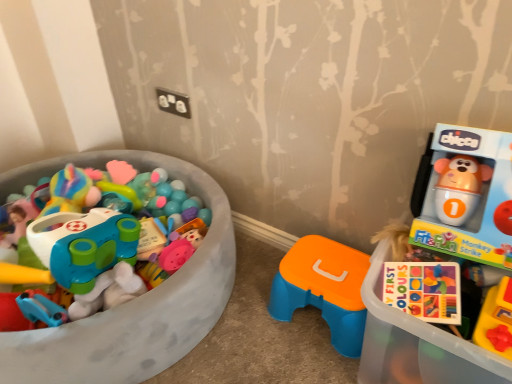
Question: From the image's perspective, is matte plastic toy car at left, the 2th toy in the right-to-left sequence, on orange plastic stool at center, arranged as the second toy when viewed from the left?

Choices:
 (A) no
 (B) yes

Answer: (B)

Question: Considering the relative sizes of matte plastic toy car at left, the 2th toy in the right-to-left sequence, and orange plastic stool at center, the first toy positioned from the right, in the image provided, is matte plastic toy car at left, the 2th toy in the right-to-left sequence, wider than orange plastic stool at center, the first toy positioned from the right,?

Choices:
 (A) no
 (B) yes

Answer: (B)

Question: Is matte plastic toy car at left, which appears as the first toy when viewed from the left, positioned before orange plastic stool at center, the first toy positioned from the right?

Choices:
 (A) no
 (B) yes

Answer: (B)

Question: From a real-world perspective, is matte plastic toy car at left, the 2th toy in the right-to-left sequence, physically above orange plastic stool at center, the first toy positioned from the right?

Choices:
 (A) yes
 (B) no

Answer: (A)

Question: Is matte plastic toy car at left, the 2th toy in the right-to-left sequence, facing towards orange plastic stool at center, the first toy positioned from the right?

Choices:
 (A) yes
 (B) no

Answer: (B)

Question: Considering the relative positions of matte plastic toy at right and matte plastic toy car at left, the 2th toy in the right-to-left sequence, in the image provided, is matte plastic toy at right to the left or to the right of matte plastic toy car at left, the 2th toy in the right-to-left sequence,?

Choices:
 (A) left
 (B) right

Answer: (B)

Question: From a real-world perspective, is matte plastic toy at right physically located above or below matte plastic toy car at left, the 2th toy in the right-to-left sequence?

Choices:
 (A) above
 (B) below

Answer: (A)

Question: From the image's perspective, relative to matte plastic toy car at left, the 2th toy in the right-to-left sequence, is matte plastic toy at right above or below?

Choices:
 (A) above
 (B) below

Answer: (B)

Question: Is matte plastic toy at right spatially inside matte plastic toy car at left, the 2th toy in the right-to-left sequence, or outside of it?

Choices:
 (A) outside
 (B) inside

Answer: (A)

Question: Considering the positions of orange plastic stool at center, the first toy positioned from the right, and matte plastic toy at right in the image, is orange plastic stool at center, the first toy positioned from the right, taller or shorter than matte plastic toy at right?

Choices:
 (A) short
 (B) tall

Answer: (A)

Question: In the image, is orange plastic stool at center, the first toy positioned from the right, positioned in front of or behind matte plastic toy at right?

Choices:
 (A) behind
 (B) front

Answer: (A)

Question: Considering the positions of orange plastic stool at center, arranged as the second toy when viewed from the left, and matte plastic toy at right in the image, is orange plastic stool at center, arranged as the second toy when viewed from the left, wider or thinner than matte plastic toy at right?

Choices:
 (A) wide
 (B) thin

Answer: (B)

Question: Based on their sizes in the image, would you say orange plastic stool at center, arranged as the second toy when viewed from the left, is bigger or smaller than matte plastic toy at right?

Choices:
 (A) big
 (B) small

Answer: (B)

Question: Relative to matte plastic toy at right, is matte plastic toy car at left, which appears as the first toy when viewed from the left, in front or behind?

Choices:
 (A) behind
 (B) front

Answer: (A)

Question: Is matte plastic toy car at left, which appears as the first toy when viewed from the left, situated inside matte plastic toy at right or outside?

Choices:
 (A) outside
 (B) inside

Answer: (A)